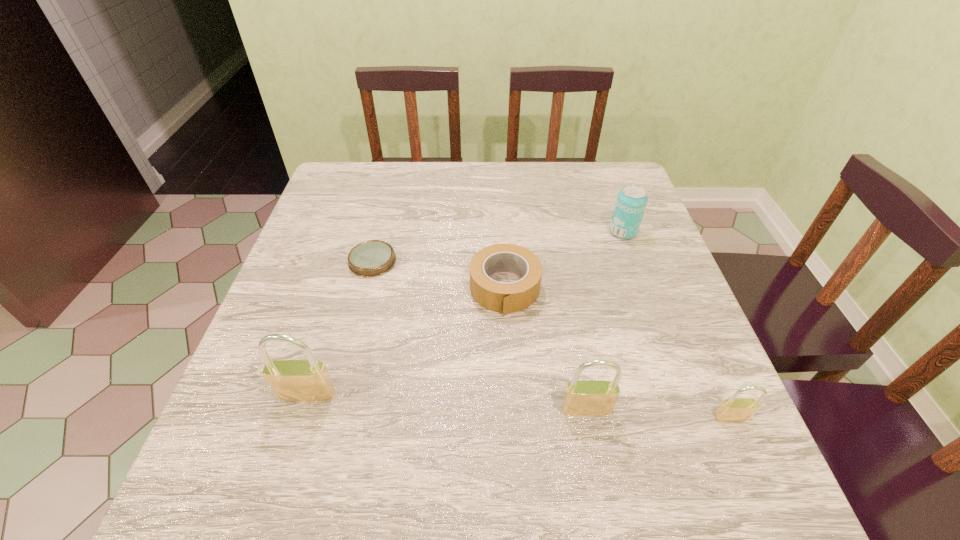
In the image, there is a desktop. Identify the location of free region at the far edge. (545, 186).

Where is `vacant space at the near edge of the desktop`? The width and height of the screenshot is (960, 540). vacant space at the near edge of the desktop is located at coordinates (553, 407).

You are a GUI agent. You are given a task and a screenshot of the screen. Output one action in this format:
    pyautogui.click(x=<x>, y=<y>)
    Task: Click on the free space at the left edge of the desktop
    Image resolution: width=960 pixels, height=540 pixels.
    Given the screenshot: What is the action you would take?
    pyautogui.click(x=283, y=284)

In the image, there is a desktop. In order to click on vacant region at the right edge in this screenshot , I will do `click(659, 377)`.

The image size is (960, 540). Identify the location of free space at the near left corner of the desktop. (274, 409).

Find the location of a particular element. The width and height of the screenshot is (960, 540). free region at the far right corner of the desktop is located at coordinates (588, 204).

The height and width of the screenshot is (540, 960). In the image, there is a desktop. In order to click on vacant space at the near right corner in this screenshot , I will do `click(666, 434)`.

What are the coordinates of `free space between the farthest padlock and the second tallest padlock` in the screenshot? It's located at (446, 402).

Locate an element on the screen. The height and width of the screenshot is (540, 960). free spot between the shortest object and the second padlock from left to right is located at coordinates (479, 335).

This screenshot has width=960, height=540. I want to click on free spot between the second shortest object and the rightmost padlock, so [618, 353].